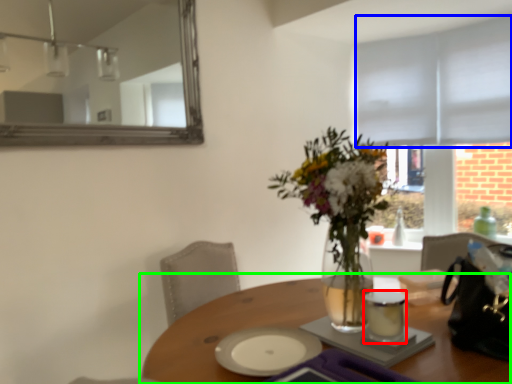
Question: Estimate the real-world distances between objects in this image. Which object is closer to tableware (highlighted by a red box), blind (highlighted by a blue box) or table (highlighted by a green box)?

Choices:
 (A) blind
 (B) table

Answer: (B)